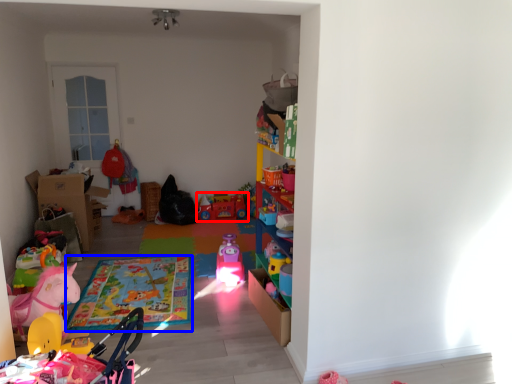
Question: Which object is closer to the camera taking this photo, toy (highlighted by a red box) or mat (highlighted by a blue box)?

Choices:
 (A) toy
 (B) mat

Answer: (B)